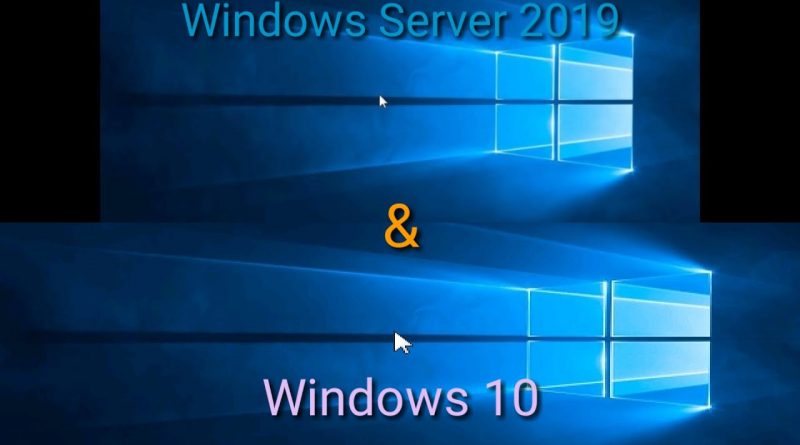
Where is `black screen`? The height and width of the screenshot is (445, 800). black screen is located at coordinates (56, 107), (701, 97).